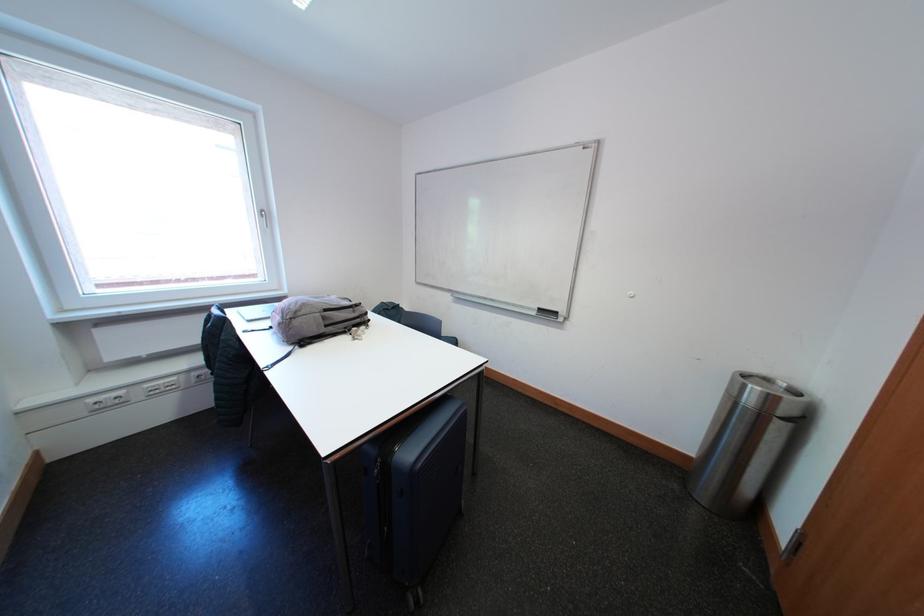
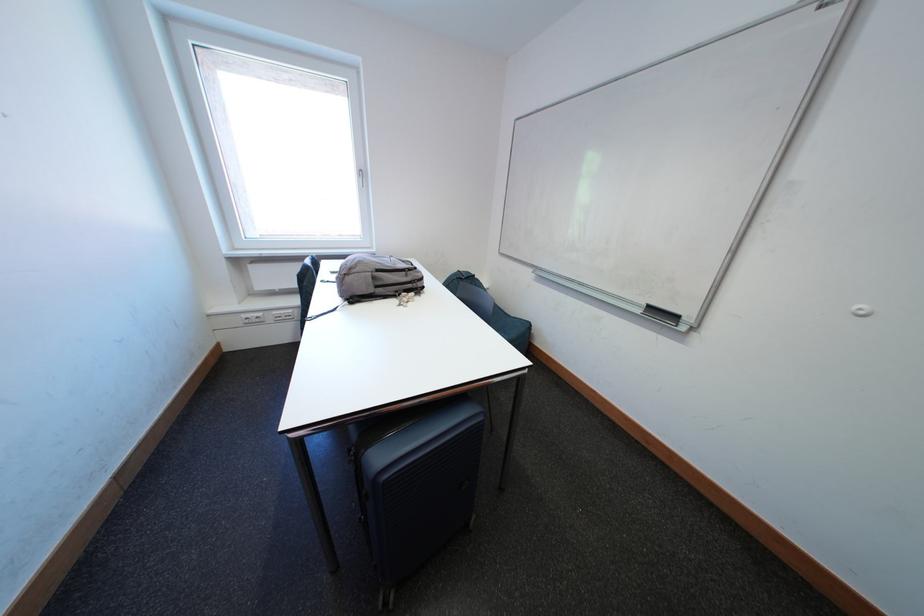
Locate, in the second image, the point that corresponds to the point at 543,317 in the first image.

(649, 315)